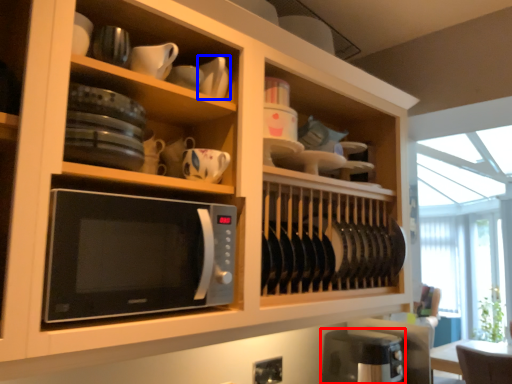
Question: Which point is further to the camera, appliance (highlighted by a red box) or tableware (highlighted by a blue box)?

Choices:
 (A) appliance
 (B) tableware

Answer: (A)